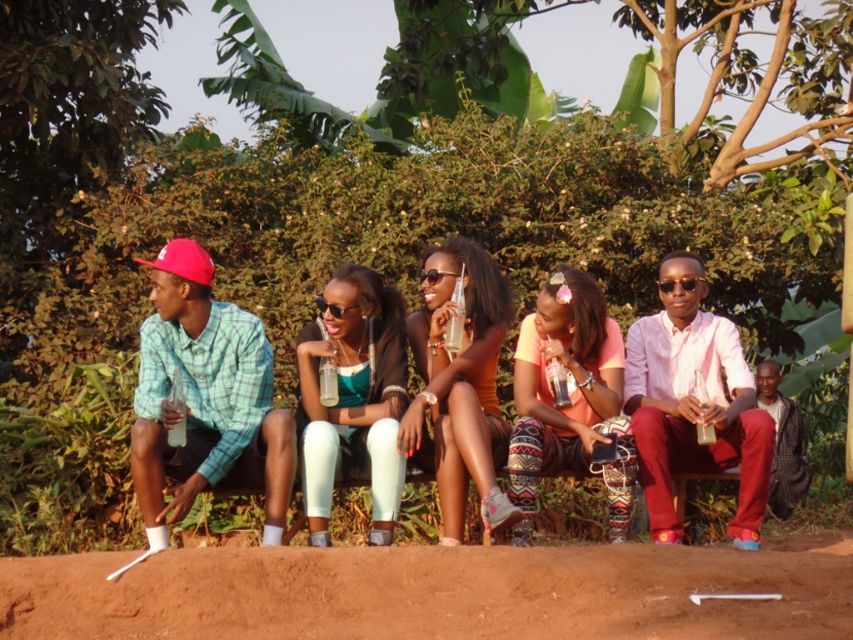
In the scene shown: You are a photographer trying to capture a group photo of the orange cotton shirt at center and the matte orange tank top at center. The camera you have can focus on objects within a 40 cm range. Will both subjects be in focus?

The distance between orange cotton shirt at center and matte orange tank top at center is 42.23 centimeters, which exceeds the camera focus range of 40 cm. Therefore, both subjects cannot be in focus simultaneously.

You are a photographer trying to capture a group photo of the scene. The camera you are using has a limited depth of field that can only focus on objects at a certain height. The brown dirt track at lower center and the orange cotton shirt at center are both in the frame. Which object should you focus on to ensure it appears sharp if you want the one closer to the camera to be in focus?

The brown dirt track at lower center has a lesser height compared to orange cotton shirt at center, so you should focus on the orange cotton shirt at center since it is closer to the camera.

You are a photographer trying to capture a candid shot of the two people at the center of the group. The orange cotton shirt at center and the matte orange tank top at center are both in your frame. Based on their heights, which one would you focus on to ensure they are fully visible in the photo?

The orange cotton shirt at center has a lesser height compared to matte orange tank top at center, so focusing on the matte orange tank top at center would ensure it is fully visible in the photo.